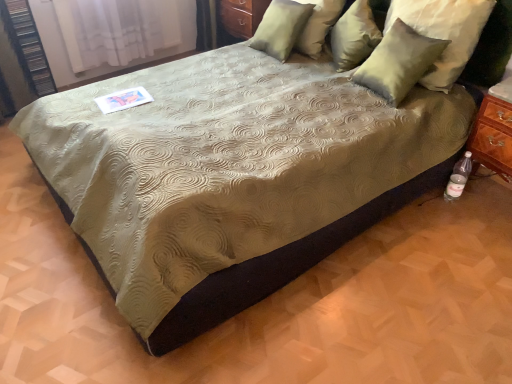
This screenshot has width=512, height=384. I want to click on free spot to the left of clear plastic bottle at lower right, so click(422, 207).